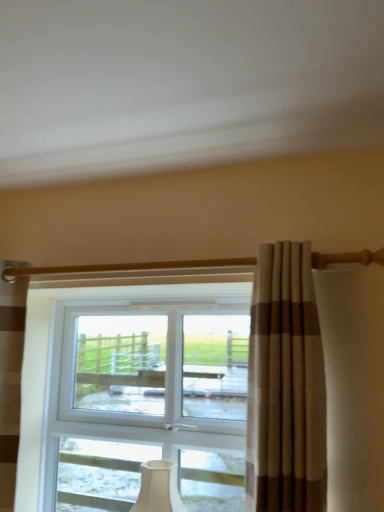
Question: Considering the positions of beige striped curtain at center, which is counted as the second curtain, starting from the back, and white matte table lamp at center in the image, is beige striped curtain at center, which is counted as the second curtain, starting from the back, bigger or smaller than white matte table lamp at center?

Choices:
 (A) small
 (B) big

Answer: (B)

Question: Considering their positions, is beige striped curtain at center, which is counted as the second curtain, starting from the back, located in front of or behind white matte table lamp at center?

Choices:
 (A) front
 (B) behind

Answer: (A)

Question: Which object is the closest to the white matte table lamp at center?

Choices:
 (A) beige striped curtain at center, which is the 1th curtain from front to back
 (B) brown striped curtain at left, placed as the second curtain when sorted from front to back

Answer: (B)

Question: Which object is positioned farthest from the beige striped curtain at center, which is the 1th curtain from front to back?

Choices:
 (A) brown striped curtain at left, which is counted as the 1th curtain, starting from the back
 (B) white matte table lamp at center

Answer: (A)